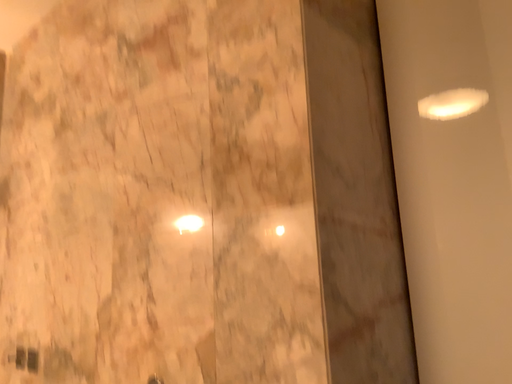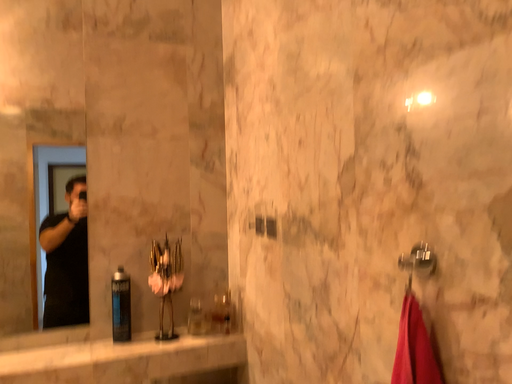
Question: Which way did the camera rotate in the video?

Choices:
 (A) rotated right
 (B) rotated left

Answer: (B)